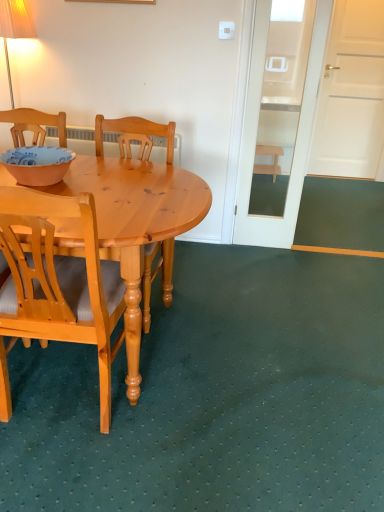
Question: Is light brown wood chair at left, positioned as the 1th chair in front-to-back order, shorter than matte orange bowl at left?

Choices:
 (A) yes
 (B) no

Answer: (B)

Question: Is light brown wood chair at left, positioned as the 1th chair in front-to-back order, positioned far away from matte orange bowl at left?

Choices:
 (A) no
 (B) yes

Answer: (A)

Question: Could you tell me if light brown wood chair at left, which is counted as the second chair, starting from the back, is turned towards matte orange bowl at left?

Choices:
 (A) no
 (B) yes

Answer: (B)

Question: From the image's perspective, would you say light brown wood chair at left, which is counted as the second chair, starting from the back, is shown under matte orange bowl at left?

Choices:
 (A) no
 (B) yes

Answer: (B)

Question: Can you confirm if light brown wood chair at left, which is counted as the second chair, starting from the back, is thinner than matte orange bowl at left?

Choices:
 (A) no
 (B) yes

Answer: (A)

Question: Looking at their shapes, would you say matte orange bowl at left is wider or thinner than light brown wood chair at left, positioned as the 1th chair in front-to-back order?

Choices:
 (A) wide
 (B) thin

Answer: (B)

Question: Is matte orange bowl at left taller or shorter than light brown wood chair at left, which is counted as the second chair, starting from the back?

Choices:
 (A) short
 (B) tall

Answer: (A)

Question: In terms of size, does matte orange bowl at left appear bigger or smaller than light brown wood chair at left, positioned as the 1th chair in front-to-back order?

Choices:
 (A) big
 (B) small

Answer: (B)

Question: From the image's perspective, relative to light brown wood chair at left, positioned as the 1th chair in front-to-back order, is matte orange bowl at left above or below?

Choices:
 (A) above
 (B) below

Answer: (A)

Question: From their relative heights in the image, would you say light wood chair at center, which ranks as the first chair in back-to-front order, is taller or shorter than wooden stool at right?

Choices:
 (A) tall
 (B) short

Answer: (A)

Question: Is point (150, 148) positioned closer to the camera than point (261, 154)?

Choices:
 (A) closer
 (B) farther

Answer: (A)

Question: Is light wood chair at center, which ranks as the first chair in back-to-front order, wider or thinner than wooden stool at right?

Choices:
 (A) wide
 (B) thin

Answer: (A)

Question: Based on their sizes in the image, would you say light wood chair at center, which ranks as the first chair in back-to-front order, is bigger or smaller than wooden stool at right?

Choices:
 (A) small
 (B) big

Answer: (B)

Question: Is wooden stool at right taller or shorter than light wood chair at center, which is the second chair from front to back?

Choices:
 (A) tall
 (B) short

Answer: (B)

Question: In terms of width, does wooden stool at right look wider or thinner when compared to light wood chair at center, which is the second chair from front to back?

Choices:
 (A) wide
 (B) thin

Answer: (B)